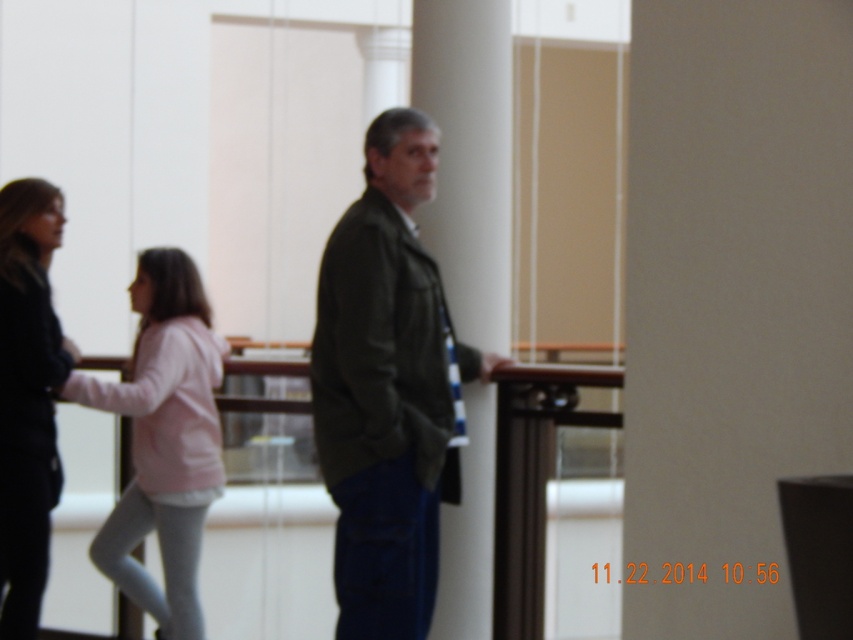
Does dark green jacket at center appear on the right side of white smooth pillar at center?

No, dark green jacket at center is not to the right of white smooth pillar at center.

Is dark green jacket at center below white smooth pillar at center?

Correct, dark green jacket at center is located below white smooth pillar at center.

Is point (416, 490) less distant than point (471, 116)?

Yes, point (416, 490) is closer to viewer.

Where is `dark green jacket at center`? The image size is (853, 640). dark green jacket at center is located at coordinates (387, 388).

Is white smooth pillar at center further to the viewer compared to black leather jacket at left?

No, white smooth pillar at center is in front of black leather jacket at left.

You are a GUI agent. You are given a task and a screenshot of the screen. Output one action in this format:
    pyautogui.click(x=<x>, y=<y>)
    Task: Click on the white smooth pillar at center
    Image resolution: width=853 pixels, height=640 pixels.
    Given the screenshot: What is the action you would take?
    pyautogui.click(x=468, y=157)

Locate an element on the screen. white smooth pillar at center is located at coordinates (468, 157).

Does dark green jacket at center have a smaller size compared to black leather jacket at left?

Incorrect, dark green jacket at center is not smaller in size than black leather jacket at left.

Is point (367, 538) positioned behind point (45, 320)?

No, it is not.

Locate an element on the screen. Image resolution: width=853 pixels, height=640 pixels. dark green jacket at center is located at coordinates (387, 388).